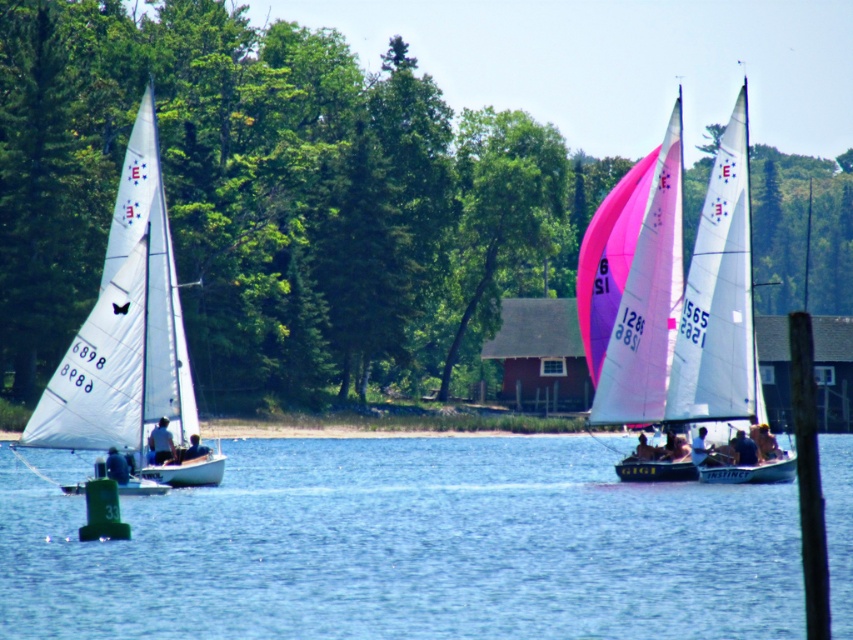
Which is below, white matte sailboat at left or dark blue fabric at lower right?

dark blue fabric at lower right

Can you confirm if white matte sailboat at left is bigger than dark blue fabric at lower right?

Yes, white matte sailboat at left is bigger than dark blue fabric at lower right.

Measure the distance between white matte sailboat at left and camera.

They are 56.05 meters apart.

Find the location of `white matte sailboat at left`. white matte sailboat at left is located at coordinates (125, 326).

Between pink matte sailboat at center and blue fabric person at lower left, which one is positioned lower?

blue fabric person at lower left is below.

Can you confirm if pink matte sailboat at center is taller than blue fabric person at lower left?

Indeed, pink matte sailboat at center has a greater height compared to blue fabric person at lower left.

The width and height of the screenshot is (853, 640). I want to click on pink matte sailboat at center, so click(x=688, y=300).

Is pink glossy sail at center shorter than dark blue fabric shirt at center?

No, pink glossy sail at center is not shorter than dark blue fabric shirt at center.

Does pink glossy sail at center come behind dark blue fabric shirt at center?

Yes, pink glossy sail at center is behind dark blue fabric shirt at center.

Describe the element at coordinates (647, 300) in the screenshot. I see `pink glossy sail at center` at that location.

What are the coordinates of `pink glossy sail at center` in the screenshot? It's located at (647, 300).